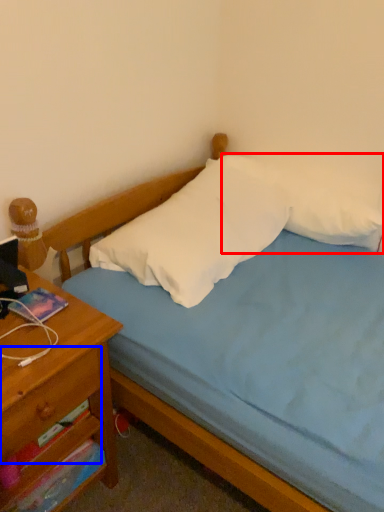
Question: Which object is closer to the camera taking this photo, pillow (highlighted by a red box) or drawer (highlighted by a blue box)?

Choices:
 (A) pillow
 (B) drawer

Answer: (B)